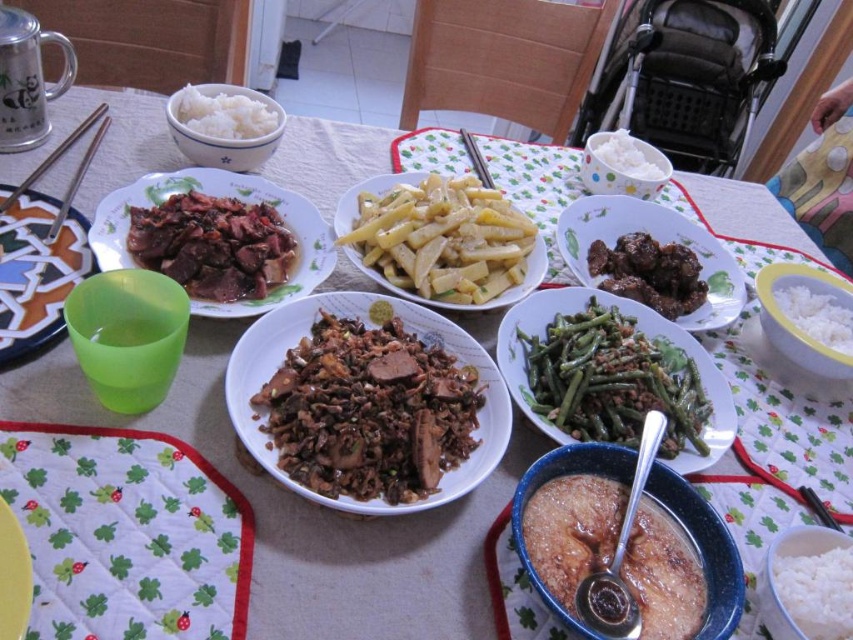
You are a diner who wants to place a 10 cm wide spoon between the yellowish matte potato at center and the brown glossy meat at center right. Is there enough space?

The yellowish matte potato at center might be wider than brown glossy meat at center right, but the exact width difference isn